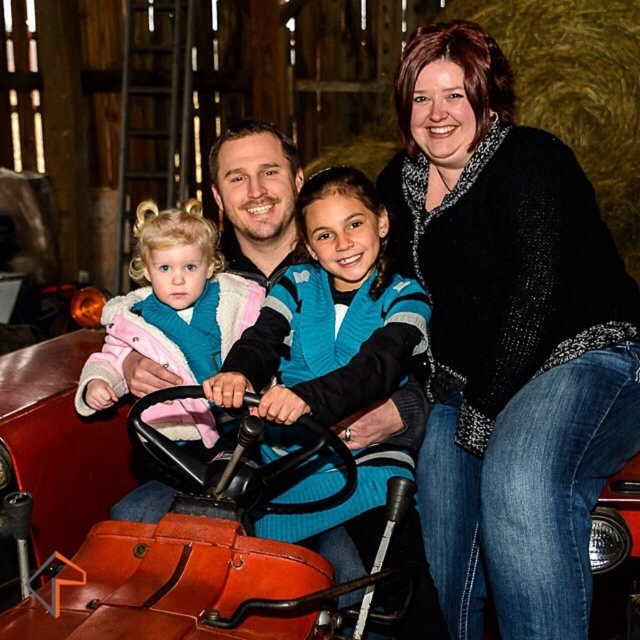
Which of these two, black textured sweater at upper right or matte teal vest at center, stands taller?

black textured sweater at upper right

Measure the distance from black textured sweater at upper right to matte teal vest at center.

The distance of black textured sweater at upper right from matte teal vest at center is 1.85 meters.

Does point (612, 321) lie behind point (188, 358)?

No, (612, 321) is closer to viewer.

Identify the location of black textured sweater at upper right. (508, 340).